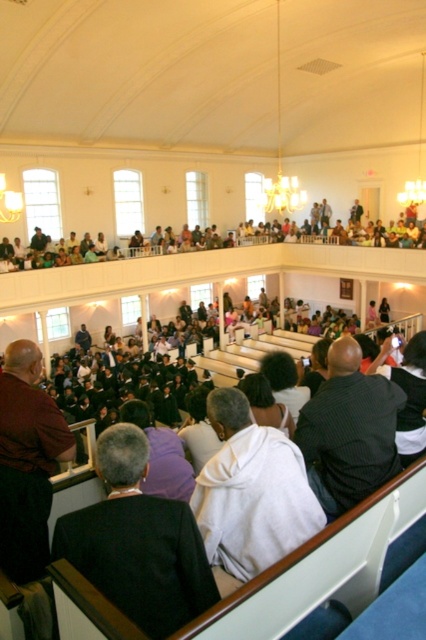
You are organizing a photo shoot and need to ensure that the black fabric suit at lower left and the dark striped shirt at center are visible in the final image. Given their sizes, which one might you need to adjust the camera angle to better capture?

The black fabric suit at lower left has a smaller size compared to the dark striped shirt at center, so you might need to adjust the camera angle to ensure the smaller black fabric suit at lower left is adequately captured in the photo.

You are a photographer in the church and want to capture a photo of the black fabric suit at lower left and the white hoodie at center. Since the camera can only focus on one subject at a time, which subject should you choose to ensure the leftmost person is in focus?

The black fabric suit at lower left is more to the left than the white hoodie at center, so you should focus on the black fabric suit at lower left to capture the leftmost person in focus.

You are a photographer standing at the back of the church and want to take a photo of the black fabric suit at lower left and the white hoodie at center. Which of the two clothing items will appear smaller in the photo?

The black fabric suit at lower left will appear smaller in the photo because it is shorter than the white hoodie at center.